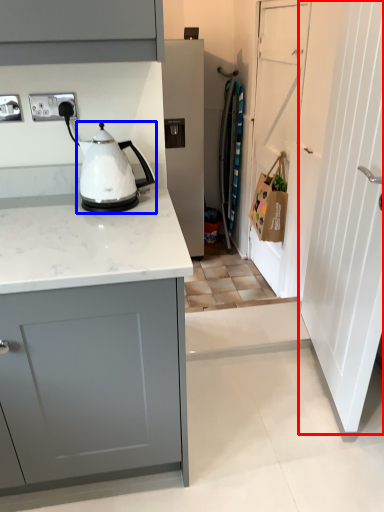
Question: Which point is closer to the camera, door (highlighted by a red box) or kitchen appliance (highlighted by a blue box)?

Choices:
 (A) door
 (B) kitchen appliance

Answer: (A)